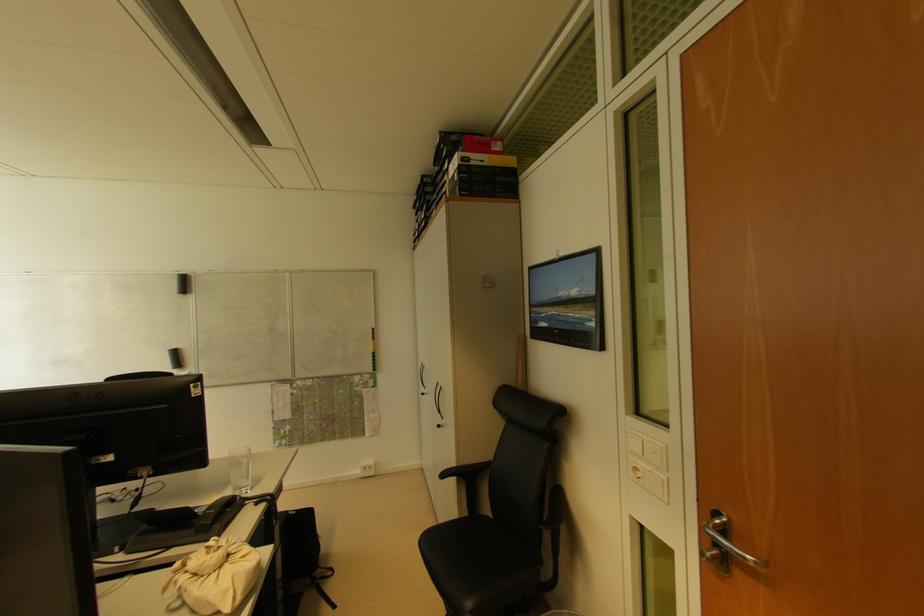
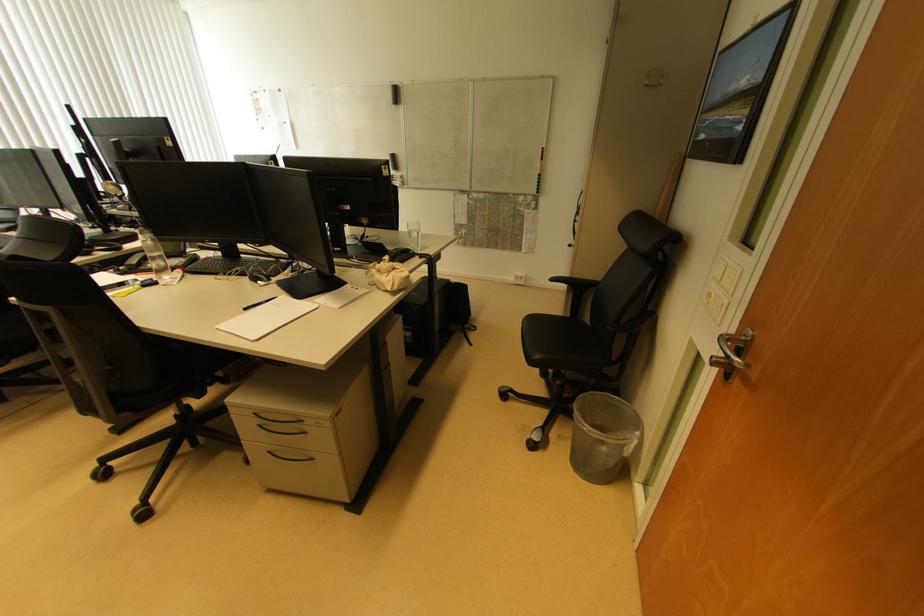
Locate, in the second image, the point that corresponds to the point at 638,471 in the first image.

(712, 297)